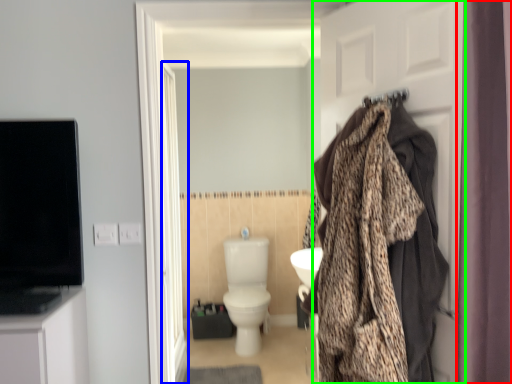
Question: Which object is positioned farthest from curtain (highlighted by a red box)? Select from screen door (highlighted by a blue box) and door (highlighted by a green box).

Choices:
 (A) screen door
 (B) door

Answer: (A)